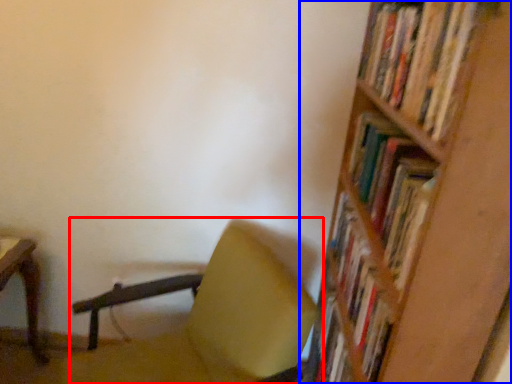
Question: Which object appears farthest to the camera in this image, chair (highlighted by a red box) or shelf (highlighted by a blue box)?

Choices:
 (A) chair
 (B) shelf

Answer: (A)